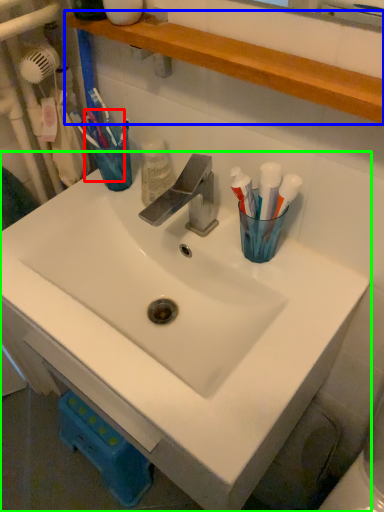
Question: Estimate the real-world distances between objects in this image. Which object is closer to toothbrush (highlighted by a red box), shelve (highlighted by a blue box) or sink (highlighted by a green box)?

Choices:
 (A) shelve
 (B) sink

Answer: (A)